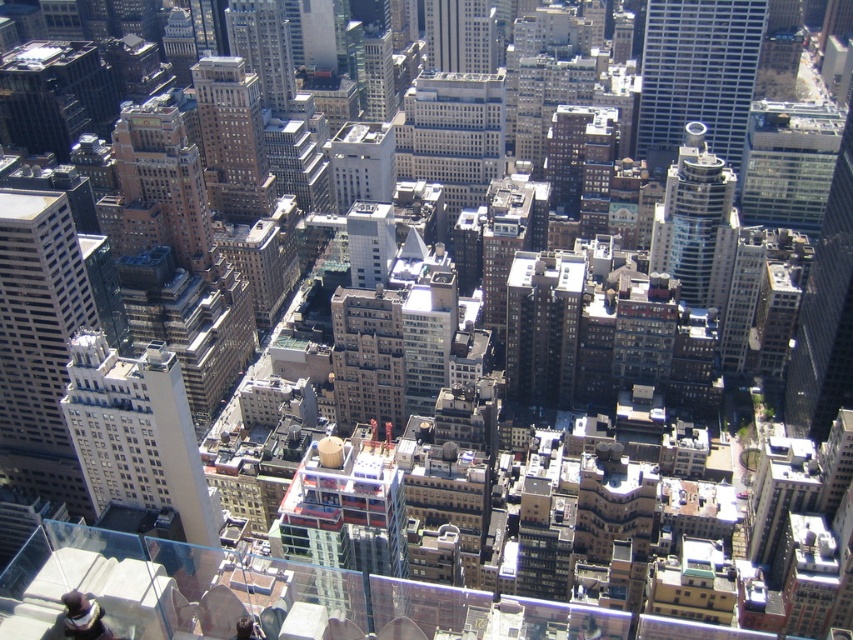
Does glassy steel skyscraper at upper right appear over white smooth building at center?

Indeed, glassy steel skyscraper at upper right is positioned over white smooth building at center.

Which is behind, point (642, 120) or point (451, 74)?

The point (642, 120) is more distant.

Image resolution: width=853 pixels, height=640 pixels. What do you see at coordinates (698, 74) in the screenshot?
I see `glassy steel skyscraper at upper right` at bounding box center [698, 74].

What are the coordinates of `glassy steel skyscraper at upper right` in the screenshot? It's located at (698, 74).

Between white smooth building at left and brown brick building at upper left, which one appears on the right side from the viewer's perspective?

brown brick building at upper left is more to the right.

Is white smooth building at left bigger than brown brick building at upper left?

No, white smooth building at left is not bigger than brown brick building at upper left.

The height and width of the screenshot is (640, 853). What do you see at coordinates (137, 435) in the screenshot?
I see `white smooth building at left` at bounding box center [137, 435].

This screenshot has height=640, width=853. What are the coordinates of `white smooth building at left` in the screenshot? It's located at (137, 435).

Who is more forward, (465, 193) or (465, 19)?

Point (465, 193)

Does white smooth building at center have a greater width compared to white glass skyscraper at center?

Correct, the width of white smooth building at center exceeds that of white glass skyscraper at center.

Locate an element on the screen. This screenshot has width=853, height=640. white smooth building at center is located at coordinates (451, 134).